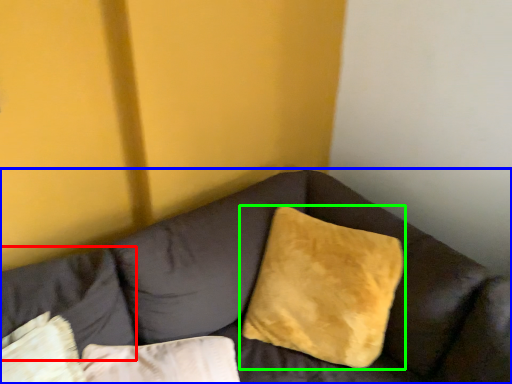
Question: Which is nearer to the pillow (highlighted by a red box)? studio couch (highlighted by a blue box) or pillow (highlighted by a green box).

Choices:
 (A) studio couch
 (B) pillow

Answer: (A)